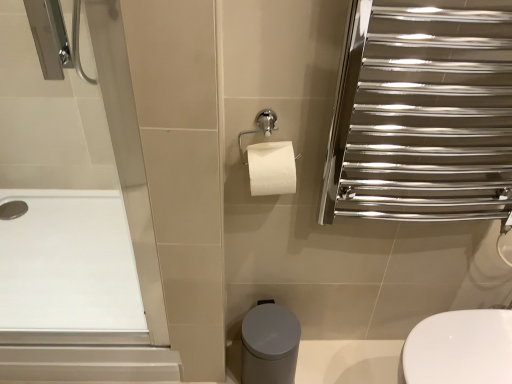
Question: Does white smooth bath at left have a greater width compared to polished chrome towel rack at upper right?

Choices:
 (A) yes
 (B) no

Answer: (A)

Question: Is white smooth bath at left taller than polished chrome towel rack at upper right?

Choices:
 (A) yes
 (B) no

Answer: (B)

Question: Is white smooth bath at left thinner than polished chrome towel rack at upper right?

Choices:
 (A) yes
 (B) no

Answer: (B)

Question: Would you say white smooth bath at left contains polished chrome towel rack at upper right?

Choices:
 (A) no
 (B) yes

Answer: (A)

Question: From a real-world perspective, is white smooth bath at left positioned over polished chrome towel rack at upper right based on gravity?

Choices:
 (A) yes
 (B) no

Answer: (B)

Question: From a real-world perspective, relative to white smooth bath at left, is polished chrome towel rack at upper right vertically above or below?

Choices:
 (A) above
 (B) below

Answer: (A)

Question: Relative to white smooth bath at left, is polished chrome towel rack at upper right in front or behind?

Choices:
 (A) front
 (B) behind

Answer: (A)

Question: From the image's perspective, is polished chrome towel rack at upper right positioned above or below white smooth bath at left?

Choices:
 (A) below
 (B) above

Answer: (B)

Question: Considering the positions of polished chrome towel rack at upper right and white smooth bath at left in the image, is polished chrome towel rack at upper right bigger or smaller than white smooth bath at left?

Choices:
 (A) big
 (B) small

Answer: (A)

Question: From the image's perspective, is polished chrome towel rack at upper right above or below white glossy toilet at lower right?

Choices:
 (A) above
 (B) below

Answer: (A)

Question: Considering the positions of polished chrome towel rack at upper right and white glossy toilet at lower right in the image, is polished chrome towel rack at upper right bigger or smaller than white glossy toilet at lower right?

Choices:
 (A) small
 (B) big

Answer: (A)

Question: Do you think polished chrome towel rack at upper right is within white glossy toilet at lower right, or outside of it?

Choices:
 (A) inside
 (B) outside

Answer: (B)

Question: Considering their positions, is polished chrome towel rack at upper right located in front of or behind white glossy toilet at lower right?

Choices:
 (A) behind
 (B) front

Answer: (B)

Question: From a real-world perspective, relative to polished chrome towel rack at upper right, is white glossy toilet at lower right vertically above or below?

Choices:
 (A) above
 (B) below

Answer: (B)

Question: Considering their positions, is white glossy toilet at lower right located in front of or behind polished chrome towel rack at upper right?

Choices:
 (A) behind
 (B) front

Answer: (A)